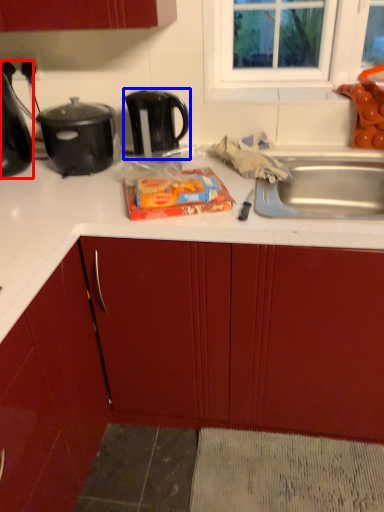
Question: Which point is closer to the camera, kitchen appliance (highlighted by a red box) or kettle (highlighted by a blue box)?

Choices:
 (A) kitchen appliance
 (B) kettle

Answer: (A)